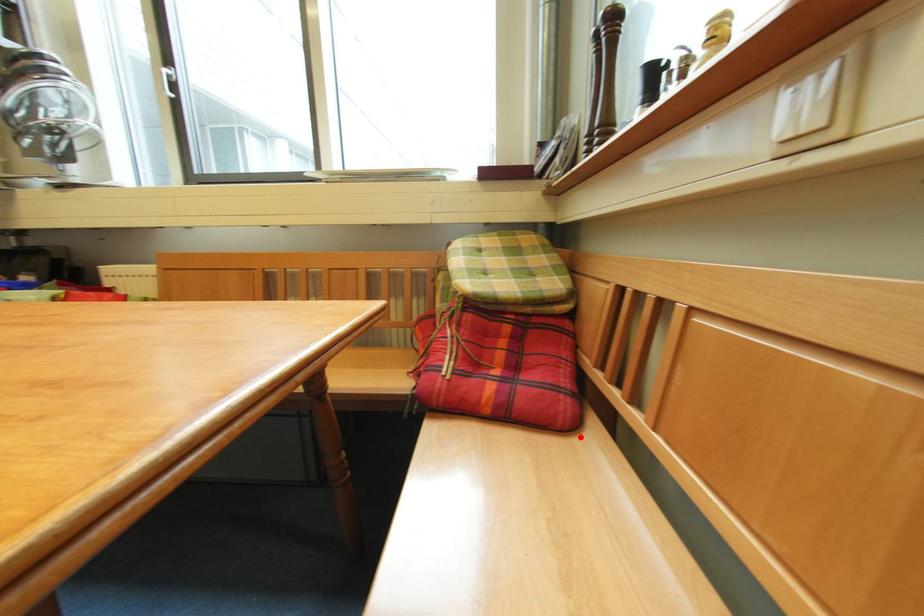
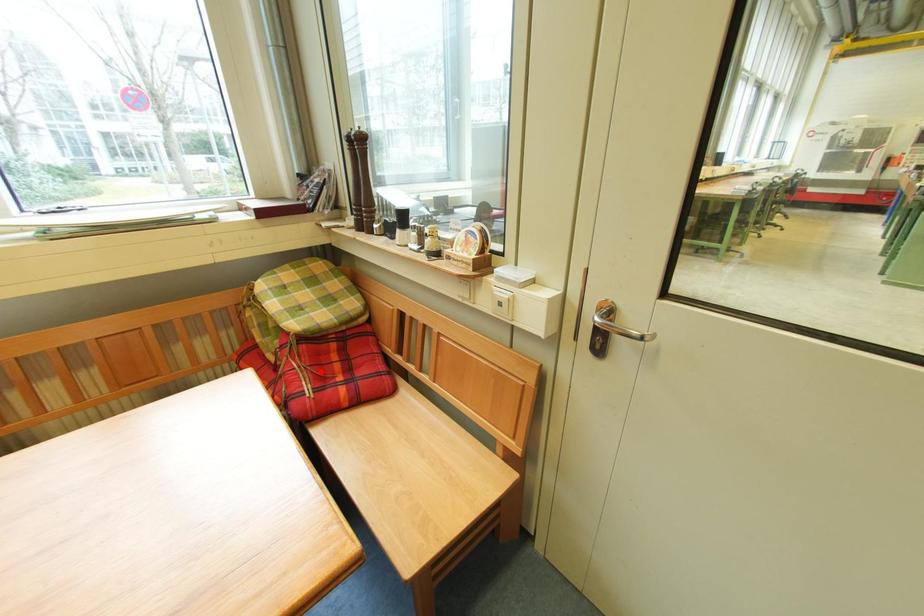
I am providing you with two images of the same scene from different viewpoints. A red point is marked on the first image and another point is marked on the second image. Do the highlighted points in image1 and image2 indicate the same real-world spot?

No